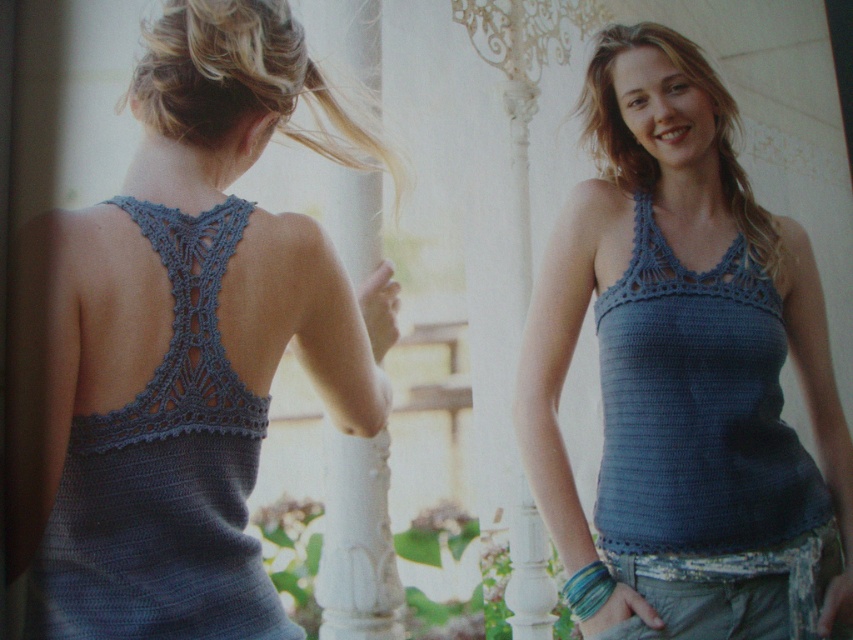
Does knitted blue tank top at back have a lesser height compared to denim crochet halter top at center?

Indeed, knitted blue tank top at back has a lesser height compared to denim crochet halter top at center.

Does knitted blue tank top at back appear on the right side of denim crochet halter top at center?

No, knitted blue tank top at back is not to the right of denim crochet halter top at center.

This screenshot has height=640, width=853. What do you see at coordinates (165, 476) in the screenshot?
I see `knitted blue tank top at back` at bounding box center [165, 476].

Where is `knitted blue tank top at back`? Image resolution: width=853 pixels, height=640 pixels. knitted blue tank top at back is located at coordinates (165, 476).

How distant is denim crochet halter top at center from blondehair at right?

They are 6.01 inches apart.

Between denim crochet halter top at center and blondehair at right, which one has more height?

denim crochet halter top at center

Find the location of a particular element. The width and height of the screenshot is (853, 640). denim crochet halter top at center is located at coordinates (695, 406).

Between denim crochet halter top at center and blonde hair at upper center, which one is positioned higher?

blonde hair at upper center is above.

Is denim crochet halter top at center shorter than blonde hair at upper center?

In fact, denim crochet halter top at center may be taller than blonde hair at upper center.

Between point (721, 435) and point (387, 156), which one is positioned behind?

The point (721, 435) is behind.

Locate an element on the screen. denim crochet halter top at center is located at coordinates (695, 406).